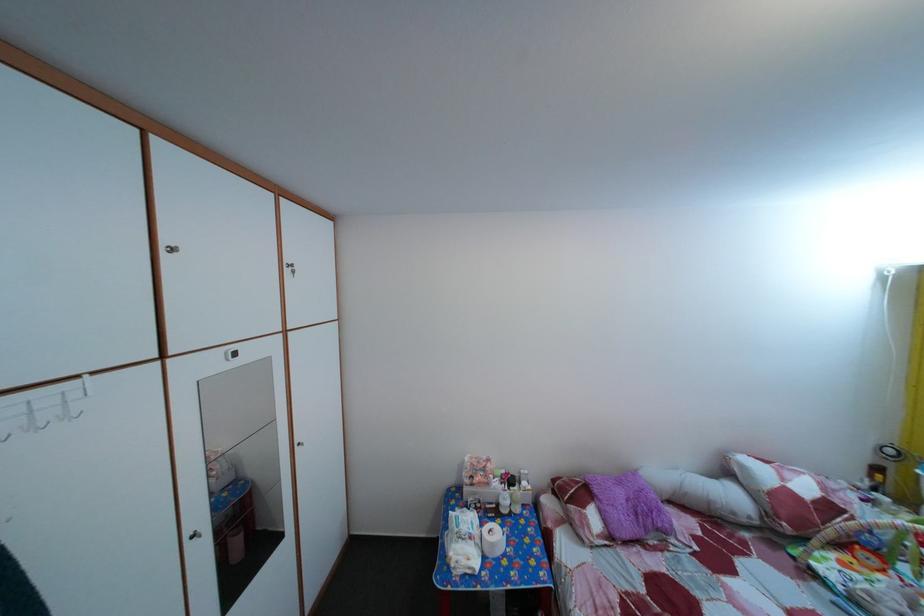
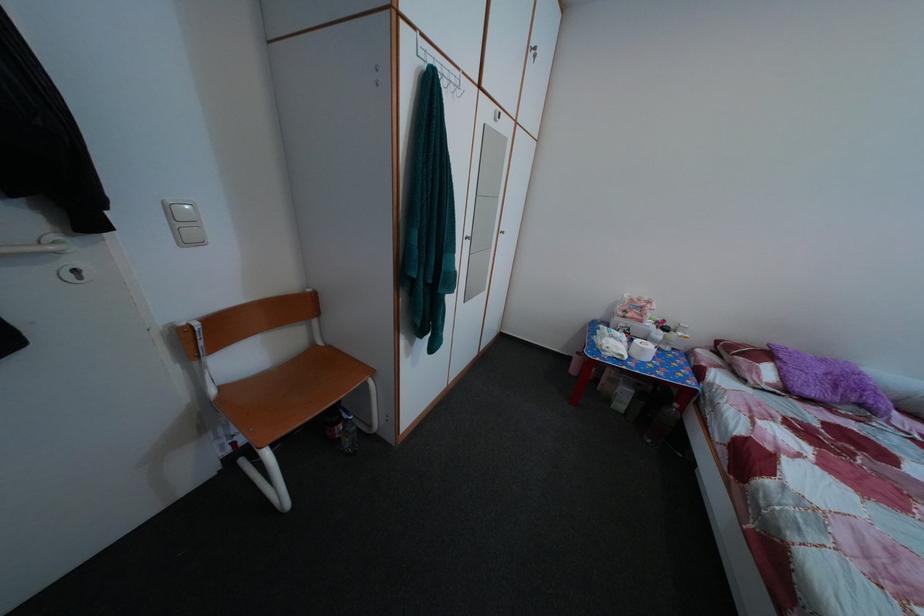
The images are taken continuously from a first-person perspective. In which direction is your viewpoint rotating?

The camera rotated toward left-down.